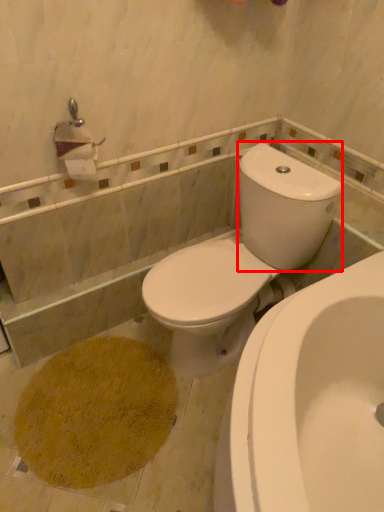
Question: From the image's perspective, considering the relative positions of water tank (annotated by the red box) and toilet in the image provided, where is water tank (annotated by the red box) located with respect to the staircase?

Choices:
 (A) above
 (B) below

Answer: (A)